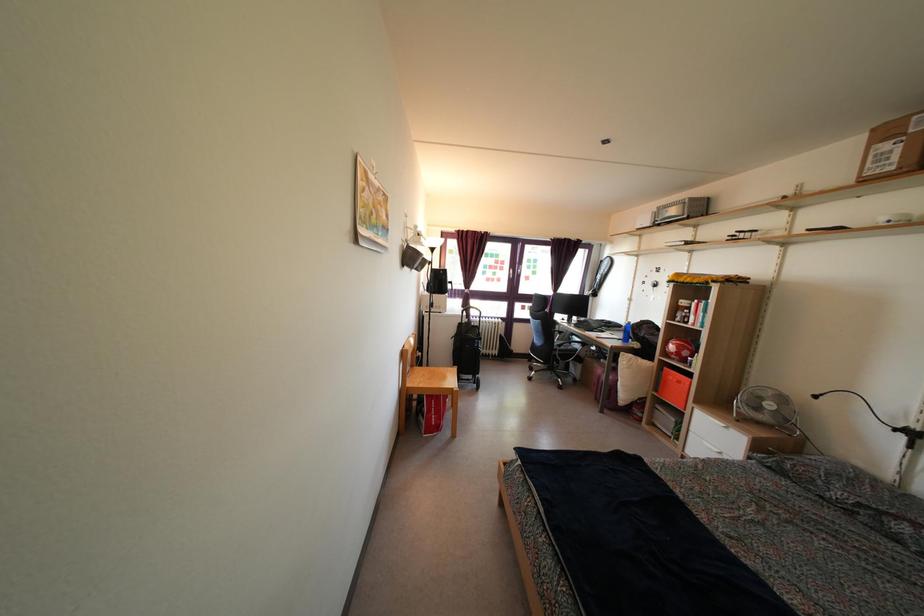
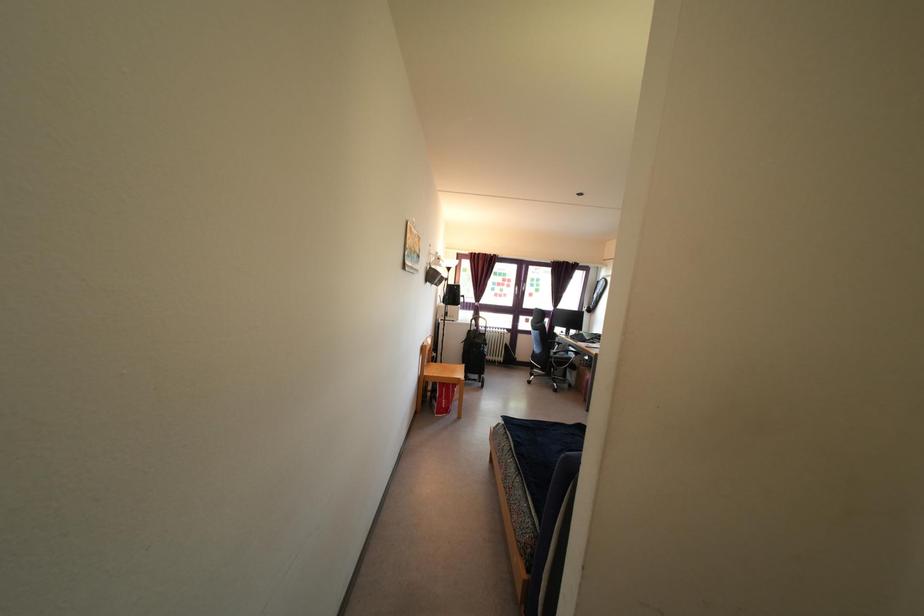
In the second image, find the point that corresponds to (x=568, y=325) in the first image.

(566, 338)